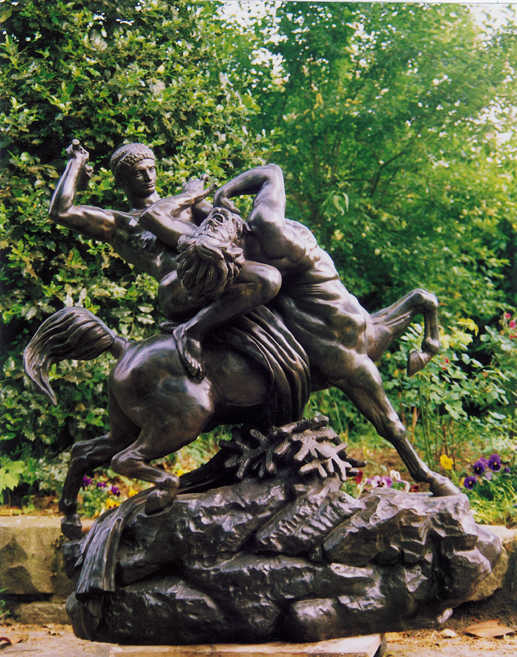
Find the location of a particular element. sculpture is located at coordinates (229, 387).